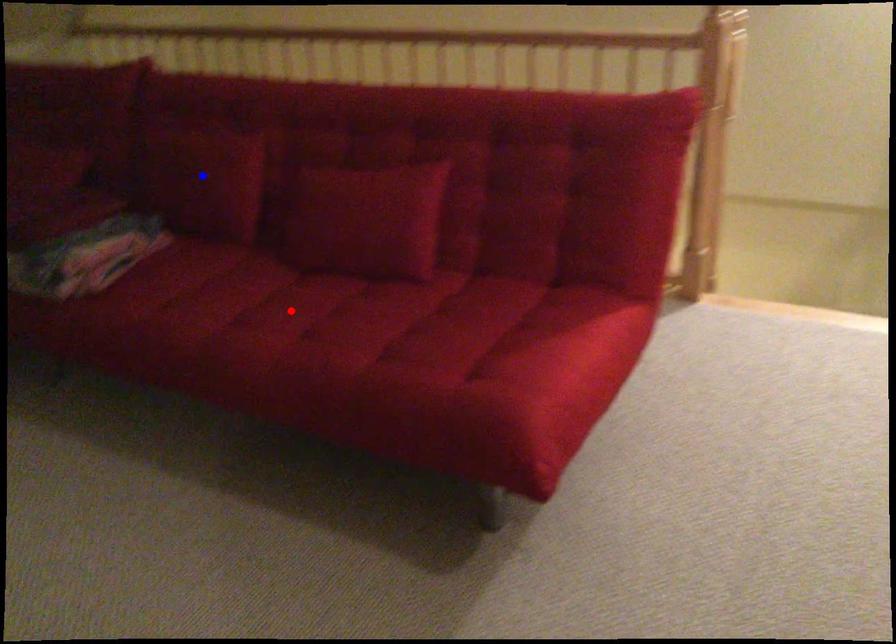
Question: In the image, two points are highlighted. Which point is nearer to the camera? Reply with the corresponding letter.

Choices:
 (A) blue point
 (B) red point

Answer: (B)